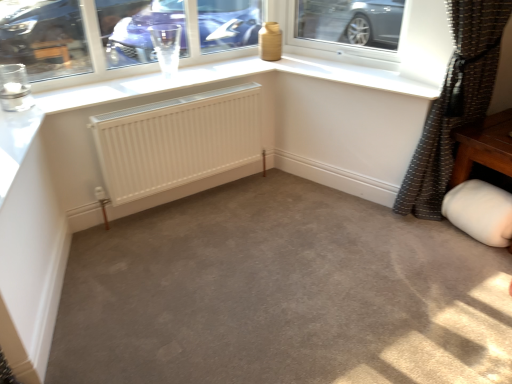
Locate an element on the screen. free space to the right of white matte radiator at center is located at coordinates (287, 215).